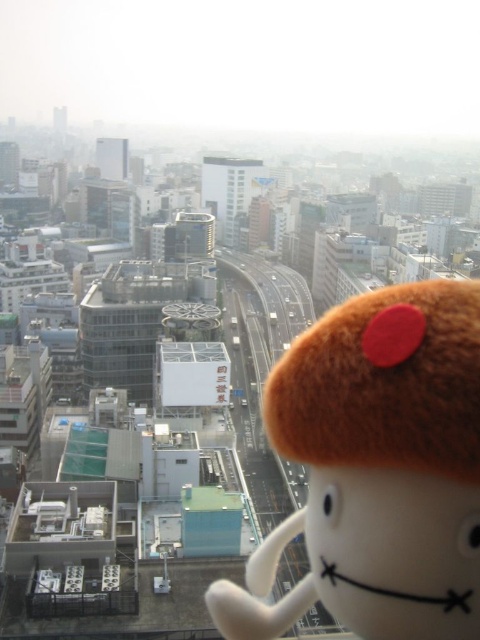
Who is more distant from viewer, (466, 422) or (345, 417)?

The point (345, 417) is behind.

Does brown plush toy at lower right have a lesser width compared to brown plush toy at center?

Yes, brown plush toy at lower right is thinner than brown plush toy at center.

What are the coordinates of `brown plush toy at lower right` in the screenshot? It's located at (376, 470).

You are a GUI agent. You are given a task and a screenshot of the screen. Output one action in this format:
    pyautogui.click(x=<x>, y=<y>)
    Task: Click on the brown plush toy at lower right
    The image size is (480, 640).
    Given the screenshot: What is the action you would take?
    pyautogui.click(x=376, y=470)